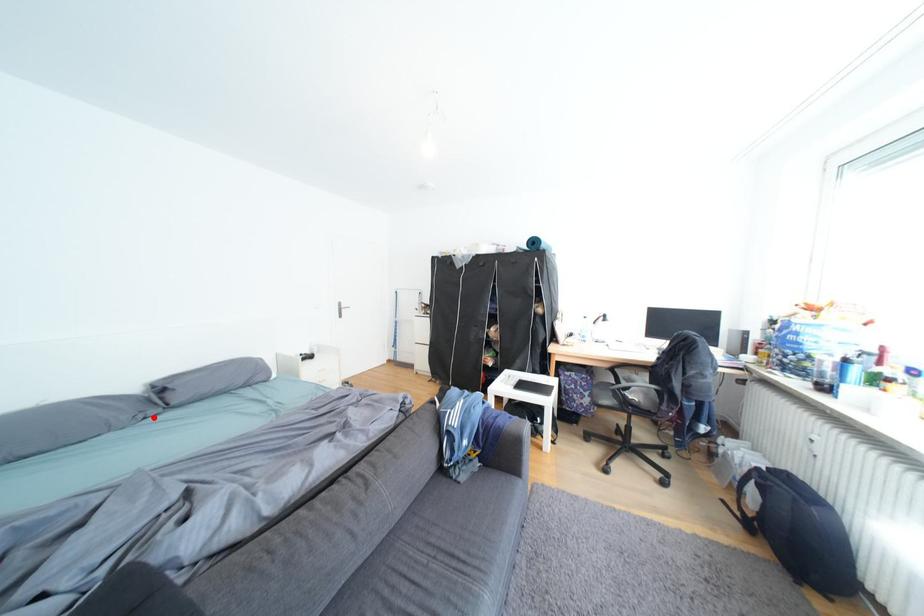
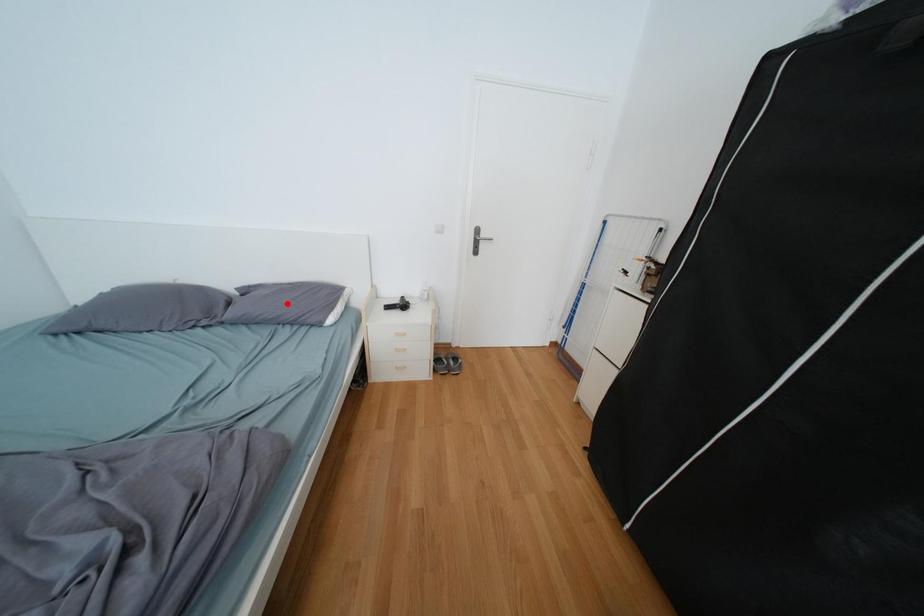
I am providing you with two images of the same scene from different viewpoints. A red point is marked on the first image and another point is marked on the second image. Are the points marked in image1 and image2 representing the same 3D position?

No